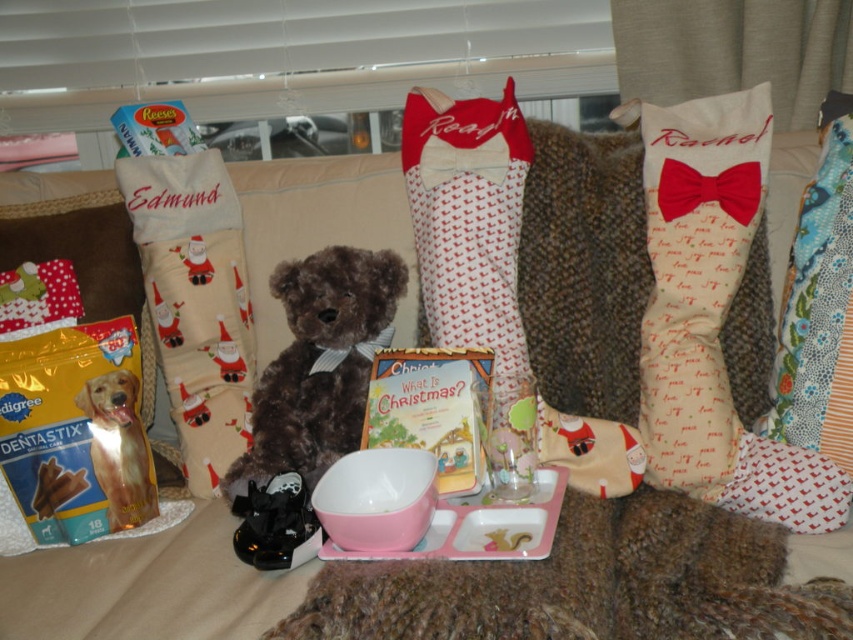
Question: Can you confirm if floral fabric cushion at right is positioned above pink plastic tray at center?

Choices:
 (A) yes
 (B) no

Answer: (A)

Question: Among these objects, which one is farthest from the camera?

Choices:
 (A) pink plastic tray at center
 (B) golden brown fur dog at lower left
 (C) floral fabric cushion at right
 (D) brown plush teddy bear at center

Answer: (B)

Question: Does floral fabric cushion at right have a lesser width compared to pink plastic tray at center?

Choices:
 (A) yes
 (B) no

Answer: (A)

Question: Among these objects, which one is farthest from the camera?

Choices:
 (A) floral fabric cushion at right
 (B) black rubber shoes at lower center
 (C) golden brown fur dog at lower left

Answer: (C)

Question: Estimate the real-world distances between objects in this image. Which object is closer to the floral fabric cushion at right?

Choices:
 (A) pink plastic tray at center
 (B) brown plush teddy bear at center
 (C) beige fabric stocking at left
 (D) black rubber shoes at lower center

Answer: (A)

Question: Is beige fabric stocking at left behind golden brown fur dog at lower left?

Choices:
 (A) no
 (B) yes

Answer: (B)